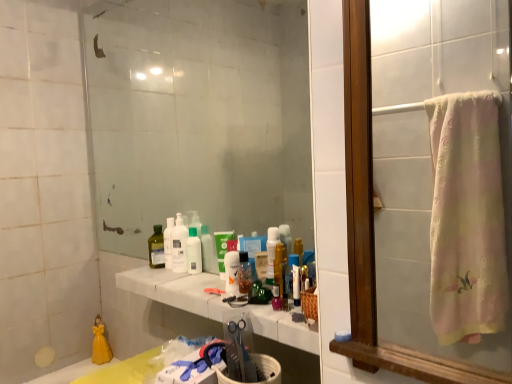
Describe the element at coordinates (199, 116) in the screenshot. The width and height of the screenshot is (512, 384). I see `transparent glass mirror at center, the second mirror from the right` at that location.

Measure the distance between point (419,318) and camera.

Point (419,318) is 29.09 inches away from camera.

You are a GUI agent. You are given a task and a screenshot of the screen. Output one action in this format:
    pyautogui.click(x=<x>, y=<y>)
    Task: Click on the translucent plastic spray bottle at center, which is counted as the 2th cleaning product, starting from the back
    This screenshot has width=512, height=384.
    Given the screenshot: What is the action you would take?
    pyautogui.click(x=271, y=252)

Locate an element on the screen. This screenshot has width=512, height=384. translucent plastic mouthwash at center, the 1th mouthwash when ordered from right to left is located at coordinates (244, 273).

Locate an element on the screen. transparent glass mirror at center, which is counted as the first mirror, starting from the left is located at coordinates (199, 116).

Identify the location of mirror that is the 2nd one above the white glossy bottle at center, placed as the 2th cleaning product when sorted from right to left (from a real-world perspective). (199, 116).

Is transparent glass mirror at center, marked as the 1th mirror in a back-to-front arrangement, positioned before white glossy bottle at center, which is counted as the first cleaning product, starting from the back?

Yes.

Which is more to the left, transparent glass mirror at center, the 2th mirror positioned from the front, or white glossy bottle at center, which is counted as the first cleaning product, starting from the back?

transparent glass mirror at center, the 2th mirror positioned from the front, is more to the left.

From a real-world perspective, is transparent glass mirror at center, the 2th mirror positioned from the front, located beneath white glossy bottle at center, which is counted as the first cleaning product, starting from the back?

Incorrect, from a real-world perspective, transparent glass mirror at center, the 2th mirror positioned from the front, is higher than white glossy bottle at center, which is counted as the first cleaning product, starting from the back.

Are translucent plastic mouthwash at center, the first mouthwash from the left, and white marble counter at center making contact?

No, translucent plastic mouthwash at center, the first mouthwash from the left, is not in contact with white marble counter at center.

Who is bigger, translucent plastic mouthwash at center, marked as the first mouthwash in a back-to-front arrangement, or white marble counter at center?

With larger size is white marble counter at center.

In the scene shown: Can you tell me how much translucent plastic mouthwash at center, the first mouthwash from the left, and white marble counter at center differ in facing direction?

The facing directions of translucent plastic mouthwash at center, the first mouthwash from the left, and white marble counter at center are 0.183 degrees apart.

From a real-world perspective, between white glossy bottle at center, which is counted as the first cleaning product, starting from the back, and translucent plastic mouthwash at center, the 3th mouthwash viewed from the back, who is vertically higher?

white glossy bottle at center, which is counted as the first cleaning product, starting from the back, is physically above.

Is white glossy bottle at center, which is counted as the second cleaning product, starting from the front, positioned far away from translucent plastic mouthwash at center, which is the 3th mouthwash from left to right?

white glossy bottle at center, which is counted as the second cleaning product, starting from the front, is near translucent plastic mouthwash at center, which is the 3th mouthwash from left to right, not far away.

Is white glossy bottle at center, placed as the 2th cleaning product when sorted from right to left, shorter than translucent plastic mouthwash at center, the 3th mouthwash viewed from the back?

In fact, white glossy bottle at center, placed as the 2th cleaning product when sorted from right to left, may be taller than translucent plastic mouthwash at center, the 3th mouthwash viewed from the back.

Who is more distant, white glossy bottle at center, which is the 1th cleaning product in left-to-right order, or translucent plastic mouthwash at center, the 1th mouthwash viewed from the front?

white glossy bottle at center, which is the 1th cleaning product in left-to-right order.

Which of these two, pink fabric towel at right, which is the 1th mirror in right-to-left order, or transparent glass mirror at center, the 2th mirror positioned from the front, is smaller?

pink fabric towel at right, which is the 1th mirror in right-to-left order, is smaller.

Is pink fabric towel at right, which is the 1th mirror in right-to-left order, positioned beyond the bounds of transparent glass mirror at center, which is counted as the first mirror, starting from the left?

pink fabric towel at right, which is the 1th mirror in right-to-left order, is positioned outside transparent glass mirror at center, which is counted as the first mirror, starting from the left.

Image resolution: width=512 pixels, height=384 pixels. What are the coordinates of `mirror located above the pink fabric towel at right, which is counted as the 1th mirror, starting from the front (from a real-world perspective)` in the screenshot? It's located at (199, 116).

Who is shorter, pink fabric towel at right, arranged as the second mirror when viewed from the left, or transparent glass mirror at center, the second mirror from the right?

pink fabric towel at right, arranged as the second mirror when viewed from the left, is shorter.

Could translucent plastic spray bottle at center, which appears as the second cleaning product when viewed from the left, be considered to be inside white marble counter at center?

Actually, translucent plastic spray bottle at center, which appears as the second cleaning product when viewed from the left, is outside white marble counter at center.

Can you tell me how much white marble counter at center and translucent plastic spray bottle at center, which appears as the second cleaning product when viewed from the left, differ in facing direction?

Answer: The angular difference between white marble counter at center and translucent plastic spray bottle at center, which appears as the second cleaning product when viewed from the left, is 0.183 degrees.

Are white marble counter at center and translucent plastic spray bottle at center, the first cleaning product from the front, making contact?

No.

Is white marble counter at center shorter than translucent plastic spray bottle at center, which appears as the second cleaning product when viewed from the left?

Indeed, white marble counter at center has a lesser height compared to translucent plastic spray bottle at center, which appears as the second cleaning product when viewed from the left.

Which is in front, point (265, 307) or point (183, 263)?

The point (265, 307) is in front.

Considering the relative sizes of white marble counter at center and white glossy bottle at center, placed as the 2th cleaning product when sorted from right to left, in the image provided, is white marble counter at center bigger than white glossy bottle at center, placed as the 2th cleaning product when sorted from right to left,?

Indeed, white marble counter at center has a larger size compared to white glossy bottle at center, placed as the 2th cleaning product when sorted from right to left.

From the picture: Is there a large distance between white marble counter at center and white glossy bottle at center, placed as the 2th cleaning product when sorted from right to left?

white marble counter at center is actually quite close to white glossy bottle at center, placed as the 2th cleaning product when sorted from right to left.

Choose the correct answer: Is transparent glass mirror at center, which is counted as the first mirror, starting from the left, inside translucent plastic mouthwash at center, the 3th mouthwash viewed from the back, or outside it?

transparent glass mirror at center, which is counted as the first mirror, starting from the left, lies outside translucent plastic mouthwash at center, the 3th mouthwash viewed from the back.

What's the angular difference between transparent glass mirror at center, the second mirror from the right, and translucent plastic mouthwash at center, the 1th mouthwash when ordered from right to left,'s facing directions?

transparent glass mirror at center, the second mirror from the right, and translucent plastic mouthwash at center, the 1th mouthwash when ordered from right to left, are facing 0.582 degrees away from each other.

Considering the positions of objects transparent glass mirror at center, the 2th mirror positioned from the front, and translucent plastic mouthwash at center, the 3th mouthwash viewed from the back, in the image provided, who is more to the left, transparent glass mirror at center, the 2th mirror positioned from the front, or translucent plastic mouthwash at center, the 3th mouthwash viewed from the back,?

transparent glass mirror at center, the 2th mirror positioned from the front.

How distant is transparent glass mirror at center, marked as the 1th mirror in a back-to-front arrangement, from translucent plastic mouthwash at center, which is the 3th mouthwash from left to right?

transparent glass mirror at center, marked as the 1th mirror in a back-to-front arrangement, is 32.03 inches away from translucent plastic mouthwash at center, which is the 3th mouthwash from left to right.

Find the location of `mirror on the left of white glossy bottle at center, which is counted as the second cleaning product, starting from the front`. mirror on the left of white glossy bottle at center, which is counted as the second cleaning product, starting from the front is located at coordinates (199, 116).

At what (x,y) coordinates should I click in order to perform the action: click on counter top on the right of translucent plastic mouthwash at center, the 3th mouthwash positioned from the front. Please return your answer as a coordinate pair (x, y). The image size is (512, 384). Looking at the image, I should click on (214, 304).

Looking at the image, which one is located closer to translucent plastic mouthwash at center, which is the 3th mouthwash from left to right, transparent glass mirror at center, which is counted as the first mirror, starting from the left, or pink fabric towel at right, which is the 1th mirror in right-to-left order?

Among the two, pink fabric towel at right, which is the 1th mirror in right-to-left order, is located nearer to translucent plastic mouthwash at center, which is the 3th mouthwash from left to right.

Which object lies further to the anchor point transparent glass mirror at center, the 2th mirror positioned from the front, white marble counter at center or translucent plastic mouthwash at center, the 3th mouthwash positioned from the front?

translucent plastic mouthwash at center, the 3th mouthwash positioned from the front.

Estimate the real-world distances between objects in this image. Which object is closer to yellow porcelain doll at lower left, transparent glass mirror at center, the 2th mirror positioned from the front, or translucent plastic spray bottle at center, the first cleaning product when ordered from right to left?

transparent glass mirror at center, the 2th mirror positioned from the front.

Looking at this image, estimate the real-world distances between objects in this image. Which object is further from pink fabric towel at right, which is the 1th mirror in right-to-left order, translucent plastic spray bottle at center, which appears as the second cleaning product when viewed from the left, or white glossy bottle at center, placed as the 2th cleaning product when sorted from right to left?

Based on the image, white glossy bottle at center, placed as the 2th cleaning product when sorted from right to left, appears to be further to pink fabric towel at right, which is the 1th mirror in right-to-left order.

Which object lies nearer to the anchor point translucent plastic spray bottle at center, the first cleaning product when ordered from right to left, green matte mouthwash at center, arranged as the 2th mouthwash when viewed from the back, or yellow porcelain doll at lower left?

green matte mouthwash at center, arranged as the 2th mouthwash when viewed from the back, is positioned closer to the anchor translucent plastic spray bottle at center, the first cleaning product when ordered from right to left.

From the image, which object appears to be farther from white glossy bottle at center, which is counted as the second cleaning product, starting from the front, green matte mouthwash at center, the second mouthwash when ordered from front to back, or translucent plastic mouthwash at center, which is the 3th mouthwash from left to right?

Based on the image, translucent plastic mouthwash at center, which is the 3th mouthwash from left to right, appears to be further to white glossy bottle at center, which is counted as the second cleaning product, starting from the front.

Which object lies further to the anchor point transparent glass mirror at center, the 2th mirror positioned from the front, translucent plastic spray bottle at center, which appears as the second cleaning product when viewed from the left, or translucent plastic mouthwash at center, marked as the first mouthwash in a back-to-front arrangement?

translucent plastic spray bottle at center, which appears as the second cleaning product when viewed from the left, is further to transparent glass mirror at center, the 2th mirror positioned from the front.

Looking at the image, which one is located closer to yellow porcelain doll at lower left, translucent plastic spray bottle at center, which appears as the second cleaning product when viewed from the left, or translucent plastic mouthwash at center, the first mouthwash from the left?

Based on the image, translucent plastic mouthwash at center, the first mouthwash from the left, appears to be nearer to yellow porcelain doll at lower left.

At what (x,y) coordinates should I click in order to perform the action: click on counter top between pink fabric towel at right, arranged as the second mirror when viewed from the left, and yellow porcelain doll at lower left from front to back. Please return your answer as a coordinate pair (x, y). Looking at the image, I should click on (214, 304).

I want to click on cleaning product between pink fabric towel at right, the 2th mirror from the back, and translucent plastic mouthwash at center, marked as the first mouthwash in a back-to-front arrangement, in the front-back direction, so click(x=271, y=252).

The width and height of the screenshot is (512, 384). Find the location of `mirror between white marble counter at center and yellow porcelain doll at lower left from front to back`. mirror between white marble counter at center and yellow porcelain doll at lower left from front to back is located at coordinates (199, 116).

Identify the location of mouthwash located between white marble counter at center and green matte mouthwash at center, arranged as the 2th mouthwash when viewed from the back, in the depth direction. (244, 273).